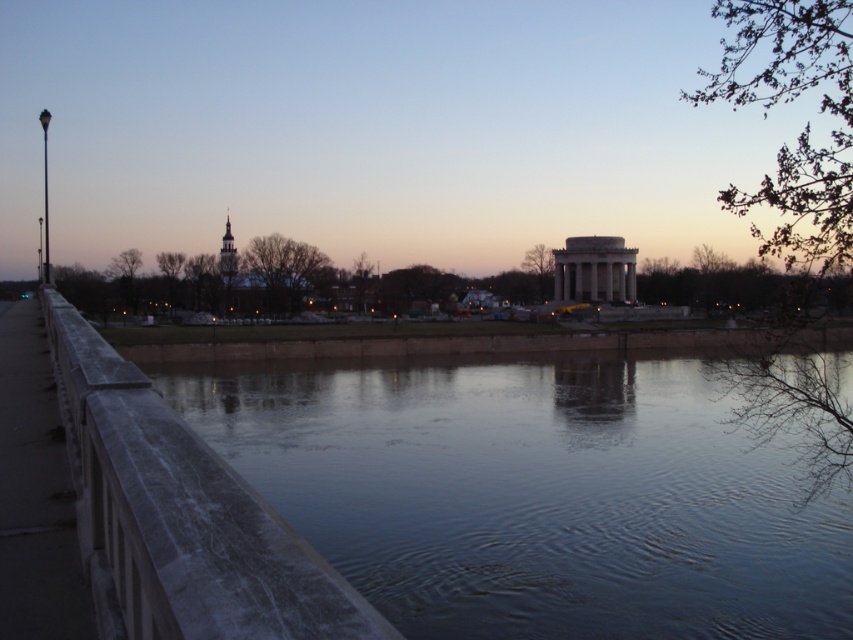
You are a maintenance worker who needs to cross from the smooth concrete railing at left to the smooth concrete river at center. Given that your equipment can only safely traverse gaps up to 18 meters, will you be able to cross safely?

The smooth concrete river at center and smooth concrete railing at left are 18.39 meters apart from each other. Since the gap is wider than the equipment can safely traverse, you will not be able to cross safely.

You are standing on the bridge and want to take a photo of the smooth concrete river at center and the smooth concrete railing at left. Which object should you focus on first if you want to capture both in one shot without moving the camera?

You should focus on the smooth concrete railing at left first because it is closer to you than the smooth concrete river at center, which is further away. This way, both objects will be in focus in the same frame.

Based on the photo, you are standing on the bridge and looking down. You see the smooth concrete river at center and the smooth concrete railing at left. Which object is positioned to the right of the other?

The smooth concrete river at center is to the right of the smooth concrete railing at left.